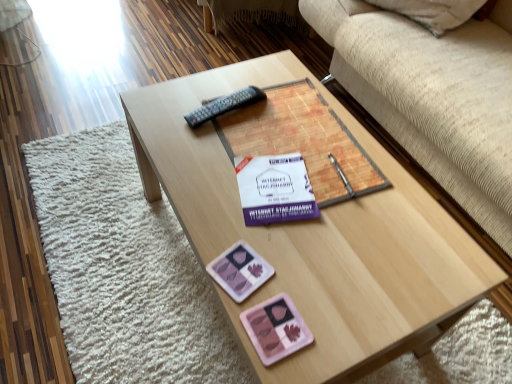
At what (x,y) coordinates should I click in order to perform the action: click on empty space that is in between matte paper book at center and pink matte palette at center, which ranks as the second currency in top-to-bottom order. Please return your answer as a coordinate pair (x, y). The image size is (512, 384). Looking at the image, I should click on (300, 242).